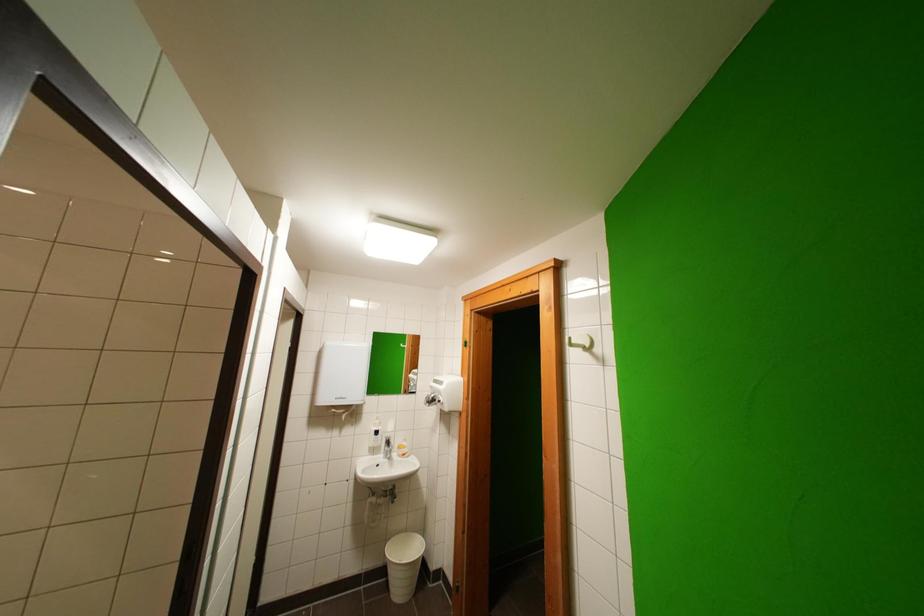
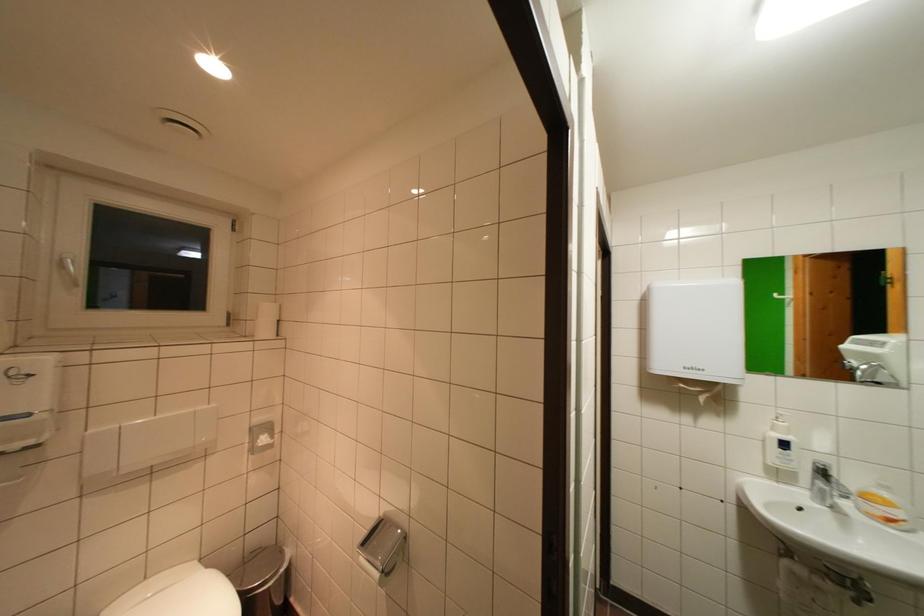
Question: The camera is either moving clockwise (left) or counter-clockwise (right) around the object. The first image is from the beginning of the video and the second image is from the end. Is the camera moving left or right when shooting the video?

Choices:
 (A) Left
 (B) Right

Answer: (B)